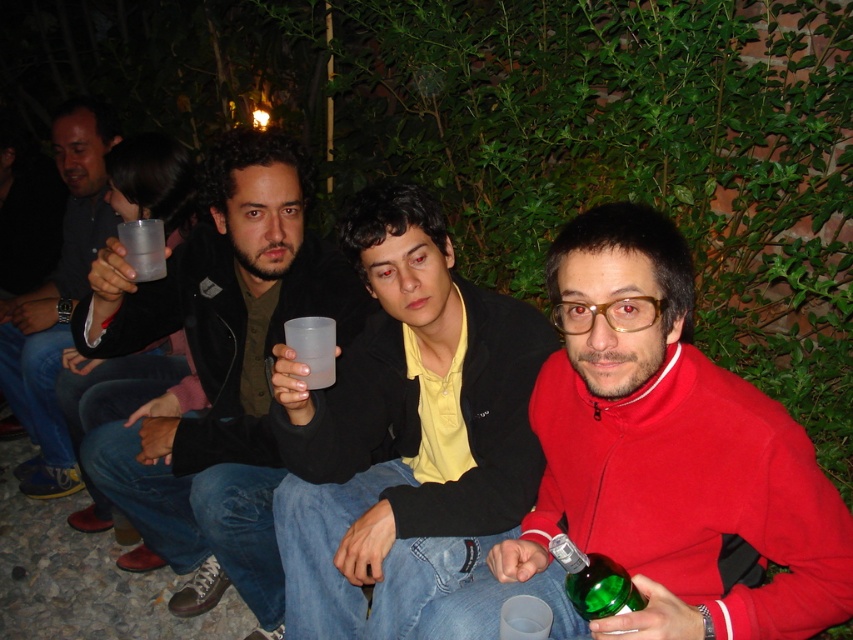
You are a waiter at this outdoor gathering. You need to deliver a drink to the person wearing the matte red sweater at center, who is seated 1.08 meters away from the transparent plastic cup at upper left. Can you safely walk in a straight line between them to reach the sweater?

The distance between the matte red sweater at center and the transparent plastic cup at upper left is 1.08 meters. Since the path is straight and unobstructed, you can safely walk in a straight line between them to reach the sweater.

You are at a party and want to grab the transparent plastic cup at upper left without disturbing the person in the matte red sweater at center. Is the cup within easy reach of the sweater?

The matte red sweater at center is below the transparent plastic cup at upper left, so the cup is above the sweater. Since the cup is positioned above, it might be within reach without disturbing the person wearing the matte red sweater at center.